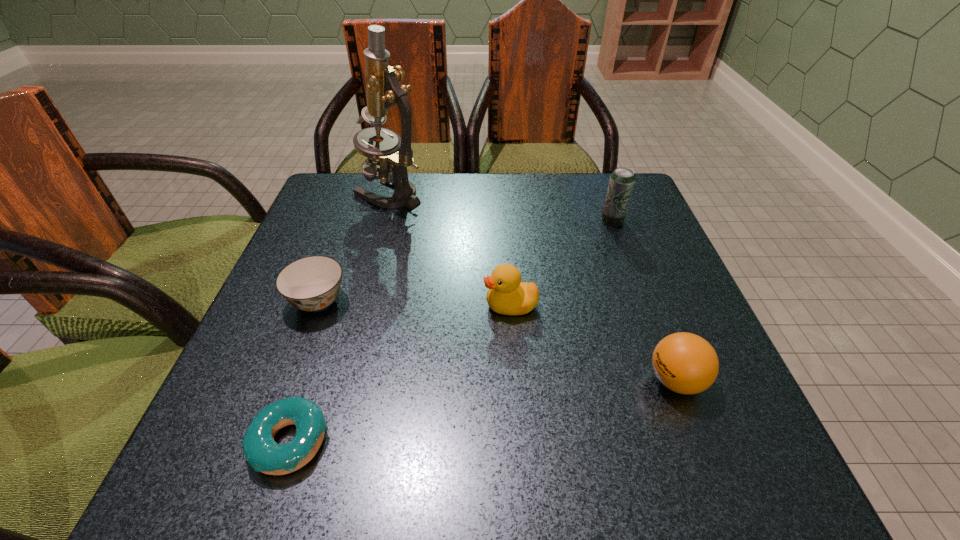
Locate an element on the screen. microscope is located at coordinates (394, 154).

What are the coordinates of `the tallest object` in the screenshot? It's located at (394, 154).

This screenshot has height=540, width=960. I want to click on the fifth nearest object, so click(621, 182).

The width and height of the screenshot is (960, 540). Find the location of `beer can`. beer can is located at coordinates (621, 182).

At what (x,y) coordinates should I click in order to perform the action: click on duck. Please return your answer as a coordinate pair (x, y). Looking at the image, I should click on (507, 295).

What are the coordinates of `the fifth farthest object` in the screenshot? It's located at (685, 363).

Identify the location of the fifth tallest object. (312, 283).

Locate an element on the screen. the nearest object is located at coordinates (264, 455).

This screenshot has height=540, width=960. What are the coordinates of `the shortest object` in the screenshot? It's located at (264, 455).

At what (x,y) coordinates should I click in order to perform the action: click on vacant space positioned on the right of the microscope. Please return your answer as a coordinate pair (x, y). Looking at the image, I should click on [x=507, y=193].